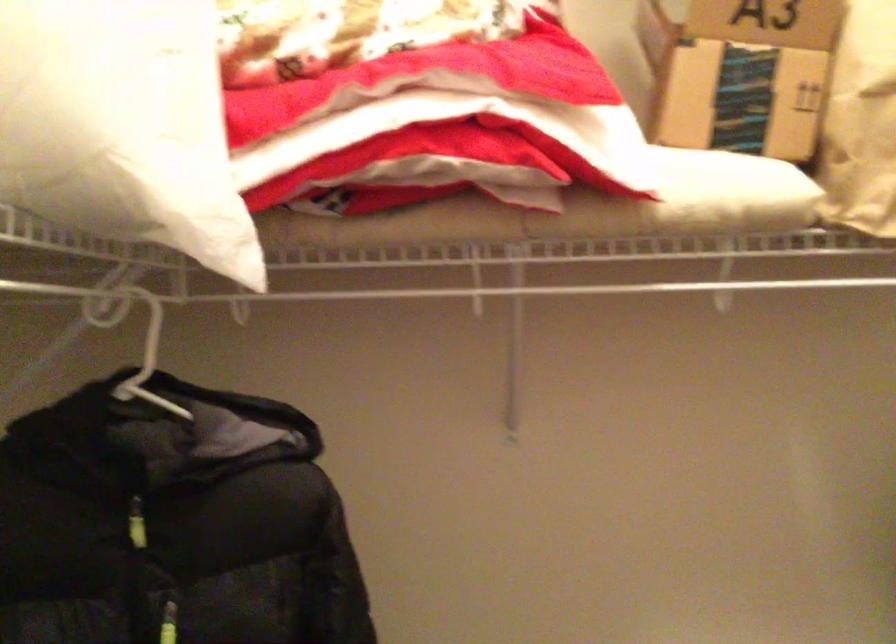
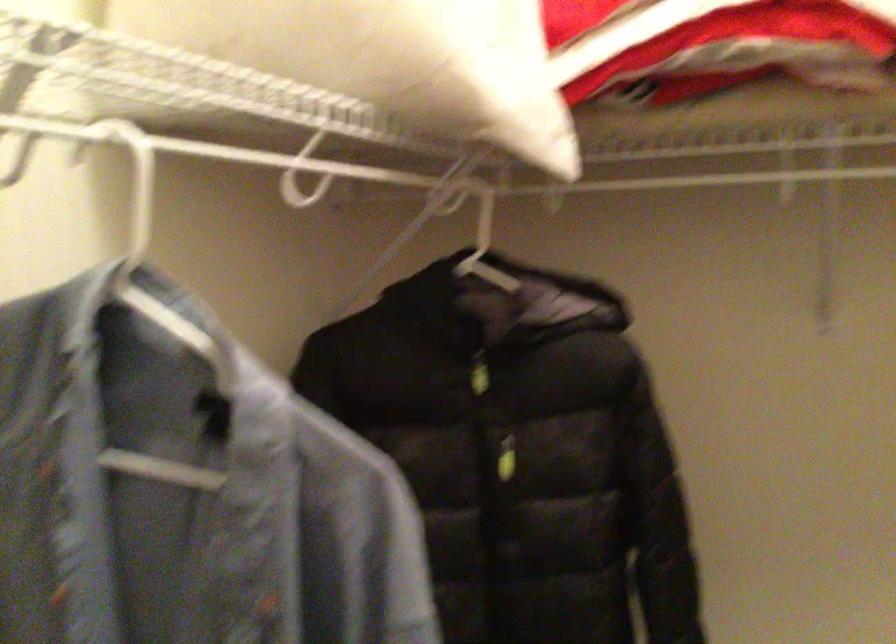
Question: In a continuous first-person perspective shot, in which direction is the camera moving?

Choices:
 (A) Left
 (B) Right
 (C) Forward
 (D) Backward

Answer: (D)